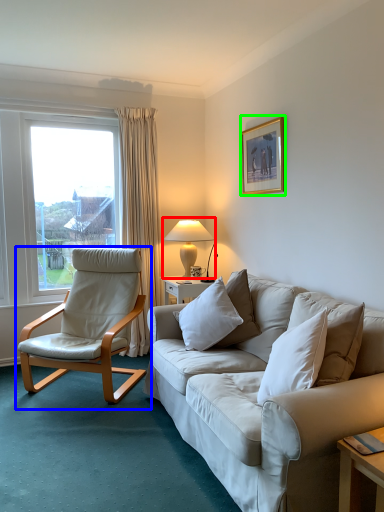
Question: Estimate the real-world distances between objects in this image. Which object is closer to table lamp (highlighted by a red box), chair (highlighted by a blue box) or picture frame (highlighted by a green box)?

Choices:
 (A) chair
 (B) picture frame

Answer: (B)